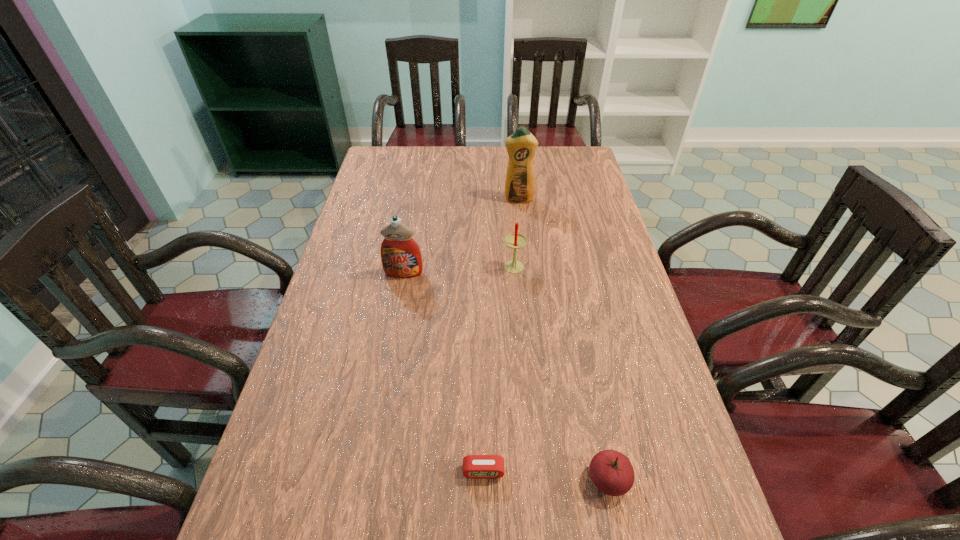
Where is `object that ranks as the fourth closest to the candle`? The image size is (960, 540). object that ranks as the fourth closest to the candle is located at coordinates (474, 466).

At what (x,y) coordinates should I click in order to perform the action: click on object that stands as the second closest to the farther detergent. Please return your answer as a coordinate pair (x, y). The image size is (960, 540). Looking at the image, I should click on (401, 257).

Find the location of `free location that satisfies the following two spatial constraints: 1. on the front-facing side of the alarm clock; 2. on the right side of the tomato`. free location that satisfies the following two spatial constraints: 1. on the front-facing side of the alarm clock; 2. on the right side of the tomato is located at coordinates (484, 480).

Locate an element on the screen. Image resolution: width=960 pixels, height=540 pixels. blank area in the image that satisfies the following two spatial constraints: 1. on the front surface of the rightmost object; 2. on the right side of the second tallest object is located at coordinates (367, 480).